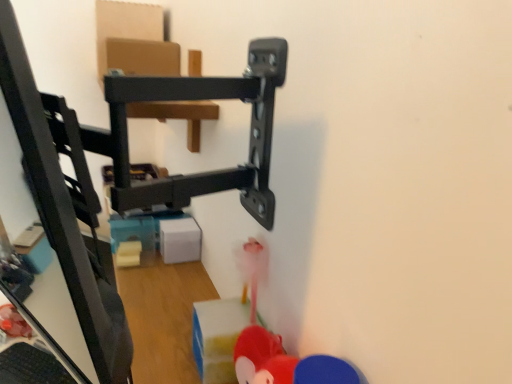
Question: Is black plastic keyboard at lower left not close to rubberized red toy at lower center, the second toy viewed from the left?

Choices:
 (A) no
 (B) yes

Answer: (B)

Question: Is black plastic keyboard at lower left smaller than rubberized red toy at lower center, the 2th toy positioned from the right?

Choices:
 (A) yes
 (B) no

Answer: (B)

Question: Considering the relative sizes of black plastic keyboard at lower left and rubberized red toy at lower center, acting as the 2th toy starting from the back, in the image provided, is black plastic keyboard at lower left shorter than rubberized red toy at lower center, acting as the 2th toy starting from the back,?

Choices:
 (A) yes
 (B) no

Answer: (A)

Question: Is black plastic keyboard at lower left with rubberized red toy at lower center, the 2th toy positioned from the right?

Choices:
 (A) no
 (B) yes

Answer: (A)

Question: Does black plastic keyboard at lower left lie behind rubberized red toy at lower center, the 2th toy positioned from the right?

Choices:
 (A) yes
 (B) no

Answer: (A)

Question: Is translucent plastic toy at lower left, acting as the first toy starting from the back, taller or shorter than black plastic keyboard at lower left?

Choices:
 (A) short
 (B) tall

Answer: (B)

Question: Is point (30, 332) positioned closer to the camera than point (67, 379)?

Choices:
 (A) farther
 (B) closer

Answer: (A)

Question: From a real-world perspective, is translucent plastic toy at lower left, the 3th toy in the front-to-back sequence, physically located above or below black plastic keyboard at lower left?

Choices:
 (A) above
 (B) below

Answer: (A)

Question: Based on their positions, is translucent plastic toy at lower left, positioned as the 1th toy in left-to-right order, located to the left or right of black plastic keyboard at lower left?

Choices:
 (A) right
 (B) left

Answer: (B)

Question: Would you say rubberized red toy at lower right, acting as the third toy starting from the left, is to the left or to the right of translucent plastic toy at lower left, which ranks as the 3th toy in right-to-left order, in the picture?

Choices:
 (A) right
 (B) left

Answer: (A)

Question: Is rubberized red toy at lower right, the first toy viewed from the front, inside or outside of translucent plastic toy at lower left, acting as the first toy starting from the back?

Choices:
 (A) inside
 (B) outside

Answer: (B)

Question: Is rubberized red toy at lower right, marked as the 3th toy in a back-to-front arrangement, taller or shorter than translucent plastic toy at lower left, which ranks as the 3th toy in right-to-left order?

Choices:
 (A) short
 (B) tall

Answer: (B)

Question: Does point (345, 374) appear closer or farther from the camera than point (22, 319)?

Choices:
 (A) farther
 (B) closer

Answer: (B)

Question: Would you say black plastic keyboard at lower left is to the left or to the right of rubberized red toy at lower center, the 2th toy positioned from the right, in the picture?

Choices:
 (A) left
 (B) right

Answer: (A)

Question: From the image's perspective, is black plastic keyboard at lower left located above or below rubberized red toy at lower center, acting as the 2th toy starting from the back?

Choices:
 (A) above
 (B) below

Answer: (B)